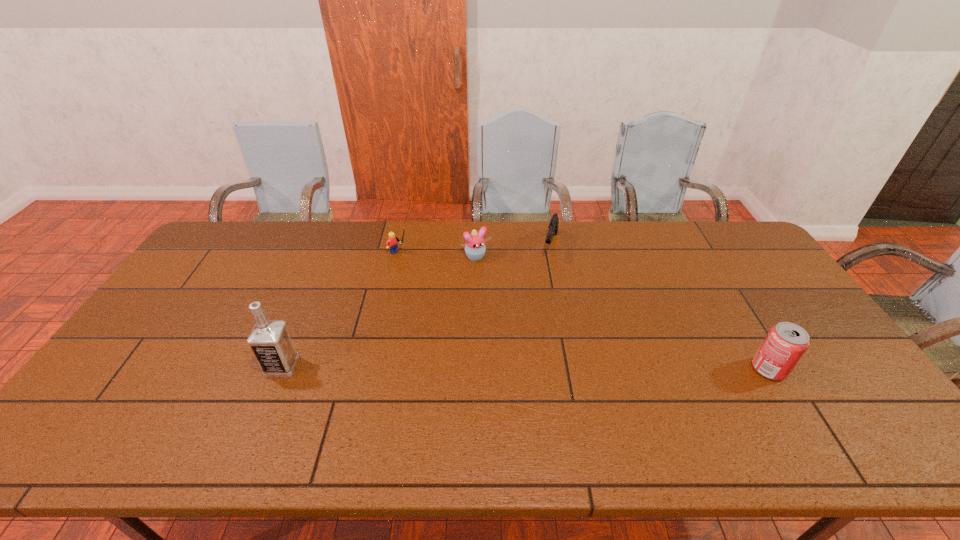
At what (x,y) coordinates should I click in order to perform the action: click on vacant region located 0.390m on the left of the rightmost object. Please return your answer as a coordinate pair (x, y). This screenshot has width=960, height=540. Looking at the image, I should click on (603, 369).

I want to click on vacant area located 0.260m at the end of the barrel of the second object from right to left, so click(536, 316).

Locate an element on the screen. The width and height of the screenshot is (960, 540). vacant space situated 0.070m at the end of the barrel of the second object from right to left is located at coordinates (547, 275).

Identify the location of vacant area situated 0.340m at the end of the barrel of the second object from right to left. (530, 335).

Locate an element on the screen. Image resolution: width=960 pixels, height=540 pixels. vacant position located 0.150m on the front-facing side of the Lego is located at coordinates (432, 276).

Find the location of a particular element. blank area located on the front-facing side of the Lego is located at coordinates (447, 288).

This screenshot has height=540, width=960. I want to click on free space located 0.330m on the front-facing side of the Lego, so click(468, 305).

Where is `vacant space located 0.240m on the face of the third object from right to left`? vacant space located 0.240m on the face of the third object from right to left is located at coordinates (515, 309).

I want to click on free space located 0.160m on the face of the third object from right to left, so click(x=503, y=292).

Locate an element on the screen. The width and height of the screenshot is (960, 540). vacant space situated 0.150m on the face of the third object from right to left is located at coordinates (502, 290).